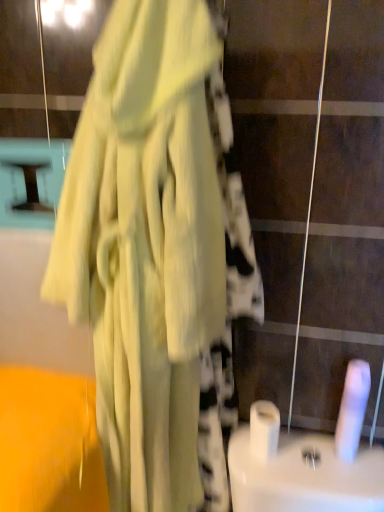
Measure the distance between white matte toilet paper at lower right, which ranks as the second toilet paper in left-to-right order, and camera.

They are 37.56 inches apart.

You are a GUI agent. You are given a task and a screenshot of the screen. Output one action in this format:
    pyautogui.click(x=<x>, y=<y>)
    Task: Click on the white matte toilet paper at lower right, which ranks as the second toilet paper in left-to-right order
    
    Given the screenshot: What is the action you would take?
    pyautogui.click(x=352, y=409)

This screenshot has width=384, height=512. I want to click on matte yellow dress at center, so click(158, 253).

From the image's perspective, which object appears higher, white glossy toilet paper at center, placed as the second toilet paper when sorted from right to left, or matte yellow dress at center?

matte yellow dress at center appears higher in the image.

In the scene shown: From a real-world perspective, relative to matte yellow dress at center, is white glossy toilet paper at center, placed as the second toilet paper when sorted from right to left, vertically above or below?

From a real-world perspective, white glossy toilet paper at center, placed as the second toilet paper when sorted from right to left, is physically below matte yellow dress at center.

Is white glossy toilet paper at center, placed as the 1th toilet paper when sorted from left to right, positioned with its back to matte yellow dress at center?

white glossy toilet paper at center, placed as the 1th toilet paper when sorted from left to right, does not have its back to matte yellow dress at center.

Is white glossy toilet paper at center, placed as the second toilet paper when sorted from right to left, positioned beyond the bounds of matte yellow dress at center?

Yes, white glossy toilet paper at center, placed as the second toilet paper when sorted from right to left, is not within matte yellow dress at center.

Which object is closer to the camera, white glossy toilet paper at center, placed as the 1th toilet paper when sorted from left to right, or white matte toilet paper at lower right, which ranks as the second toilet paper in left-to-right order?

white matte toilet paper at lower right, which ranks as the second toilet paper in left-to-right order, is more forward.

Does point (267, 431) come farther from viewer compared to point (343, 423)?

That is True.

Considering the sizes of objects white glossy toilet paper at center, placed as the second toilet paper when sorted from right to left, and white matte toilet paper at lower right, the first toilet paper when ordered from right to left, in the image provided, who is wider, white glossy toilet paper at center, placed as the second toilet paper when sorted from right to left, or white matte toilet paper at lower right, the first toilet paper when ordered from right to left,?

white glossy toilet paper at center, placed as the second toilet paper when sorted from right to left, is wider.

Is white glossy toilet paper at center, placed as the 1th toilet paper when sorted from left to right, with white matte toilet paper at lower right, which ranks as the second toilet paper in left-to-right order?

No, white glossy toilet paper at center, placed as the 1th toilet paper when sorted from left to right, is not next to white matte toilet paper at lower right, which ranks as the second toilet paper in left-to-right order.

Considering the sizes of objects matte yellow dress at center and white matte toilet paper at lower right, the first toilet paper when ordered from right to left, in the image provided, who is smaller, matte yellow dress at center or white matte toilet paper at lower right, the first toilet paper when ordered from right to left,?

With smaller size is white matte toilet paper at lower right, the first toilet paper when ordered from right to left.

This screenshot has width=384, height=512. In the image, there is a white matte toilet paper at lower right, which ranks as the second toilet paper in left-to-right order. In order to click on fancy dress above it (from the image's perspective) in this screenshot , I will do `click(158, 253)`.

Which object is closer to the camera taking this photo, matte yellow dress at center or white matte toilet paper at lower right, the first toilet paper when ordered from right to left?

matte yellow dress at center is closer to the camera.

From the image's perspective, would you say matte yellow dress at center is shown under white matte toilet paper at lower right, the first toilet paper when ordered from right to left?

No, from the image's perspective, matte yellow dress at center is not beneath white matte toilet paper at lower right, the first toilet paper when ordered from right to left.

Can you confirm if white matte toilet paper at lower right, the first toilet paper when ordered from right to left, is positioned to the left of white glossy toilet paper at center, placed as the second toilet paper when sorted from right to left?

No, white matte toilet paper at lower right, the first toilet paper when ordered from right to left, is not to the left of white glossy toilet paper at center, placed as the second toilet paper when sorted from right to left.

Is white matte toilet paper at lower right, the first toilet paper when ordered from right to left, turned away from white glossy toilet paper at center, placed as the 1th toilet paper when sorted from left to right?

No, white glossy toilet paper at center, placed as the 1th toilet paper when sorted from left to right, is not at the back of white matte toilet paper at lower right, the first toilet paper when ordered from right to left.

Is white matte toilet paper at lower right, which ranks as the second toilet paper in left-to-right order, far away from white glossy toilet paper at center, placed as the second toilet paper when sorted from right to left?

They are positioned close to each other.

How distant is matte yellow dress at center from white glossy toilet paper at center, placed as the 1th toilet paper when sorted from left to right?

matte yellow dress at center and white glossy toilet paper at center, placed as the 1th toilet paper when sorted from left to right, are 16.33 inches apart.

From the picture: Is matte yellow dress at center situated inside white glossy toilet paper at center, placed as the 1th toilet paper when sorted from left to right, or outside?

matte yellow dress at center is outside white glossy toilet paper at center, placed as the 1th toilet paper when sorted from left to right.

Relative to white glossy toilet paper at center, placed as the 1th toilet paper when sorted from left to right, is matte yellow dress at center in front or behind?

Visually, matte yellow dress at center is located in front of white glossy toilet paper at center, placed as the 1th toilet paper when sorted from left to right.

Looking at this image, from a real-world perspective, which is physically above, matte yellow dress at center or white glossy toilet paper at center, placed as the 1th toilet paper when sorted from left to right?

In real-world perspective, matte yellow dress at center is above.

Considering the relative sizes of white matte toilet paper at lower right, the first toilet paper when ordered from right to left, and matte yellow dress at center in the image provided, is white matte toilet paper at lower right, the first toilet paper when ordered from right to left, taller than matte yellow dress at center?

No, white matte toilet paper at lower right, the first toilet paper when ordered from right to left, is not taller than matte yellow dress at center.

Is white matte toilet paper at lower right, the first toilet paper when ordered from right to left, looking in the opposite direction of matte yellow dress at center?

No, white matte toilet paper at lower right, the first toilet paper when ordered from right to left, is not facing away from matte yellow dress at center.

From a real-world perspective, does white matte toilet paper at lower right, which ranks as the second toilet paper in left-to-right order, stand above matte yellow dress at center?

Incorrect, from a real-world perspective, white matte toilet paper at lower right, which ranks as the second toilet paper in left-to-right order, is lower than matte yellow dress at center.

Consider the image. What's the angular difference between white matte toilet paper at lower right, the first toilet paper when ordered from right to left, and matte yellow dress at center's facing directions?

3.98 degrees separate the facing orientations of white matte toilet paper at lower right, the first toilet paper when ordered from right to left, and matte yellow dress at center.

Where is `fancy dress on the left side of white glossy toilet paper at center, placed as the 1th toilet paper when sorted from left to right`? The width and height of the screenshot is (384, 512). fancy dress on the left side of white glossy toilet paper at center, placed as the 1th toilet paper when sorted from left to right is located at coordinates (158, 253).

Where is `toilet paper located underneath the white matte toilet paper at lower right, which ranks as the second toilet paper in left-to-right order (from a real-world perspective)`? The image size is (384, 512). toilet paper located underneath the white matte toilet paper at lower right, which ranks as the second toilet paper in left-to-right order (from a real-world perspective) is located at coordinates (264, 429).

From the image, which object appears to be farther from white matte toilet paper at lower right, which ranks as the second toilet paper in left-to-right order, white glossy toilet paper at center, placed as the second toilet paper when sorted from right to left, or matte yellow dress at center?

matte yellow dress at center is further to white matte toilet paper at lower right, which ranks as the second toilet paper in left-to-right order.

Looking at the image, which one is located closer to white glossy toilet paper at center, placed as the second toilet paper when sorted from right to left, matte yellow dress at center or white matte toilet paper at lower right, the first toilet paper when ordered from right to left?

Based on the image, white matte toilet paper at lower right, the first toilet paper when ordered from right to left, appears to be nearer to white glossy toilet paper at center, placed as the second toilet paper when sorted from right to left.

Estimate the real-world distances between objects in this image. Which object is closer to matte yellow dress at center, white matte toilet paper at lower right, which ranks as the second toilet paper in left-to-right order, or white glossy toilet paper at center, placed as the second toilet paper when sorted from right to left?

white glossy toilet paper at center, placed as the second toilet paper when sorted from right to left, is closer to matte yellow dress at center.

Which object lies nearer to the anchor point white glossy toilet paper at center, placed as the second toilet paper when sorted from right to left, white matte toilet paper at lower right, the first toilet paper when ordered from right to left, or matte yellow dress at center?

white matte toilet paper at lower right, the first toilet paper when ordered from right to left, lies closer to white glossy toilet paper at center, placed as the second toilet paper when sorted from right to left, than the other object.

Estimate the real-world distances between objects in this image. Which object is further from white matte toilet paper at lower right, which ranks as the second toilet paper in left-to-right order, matte yellow dress at center or white glossy toilet paper at center, placed as the second toilet paper when sorted from right to left?

matte yellow dress at center lies further to white matte toilet paper at lower right, which ranks as the second toilet paper in left-to-right order, than the other object.

Considering their positions, is white glossy toilet paper at center, placed as the 1th toilet paper when sorted from left to right, positioned closer to matte yellow dress at center than white matte toilet paper at lower right, the first toilet paper when ordered from right to left?

Among the two, white glossy toilet paper at center, placed as the 1th toilet paper when sorted from left to right, is located nearer to matte yellow dress at center.

Locate an element on the screen. This screenshot has width=384, height=512. toilet paper situated between matte yellow dress at center and white matte toilet paper at lower right, the first toilet paper when ordered from right to left, from left to right is located at coordinates (264, 429).